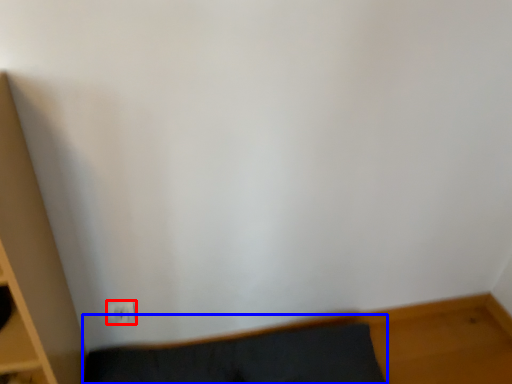
Question: Which object appears closest to the camera in this image, electric outlet (highlighted by a red box) or furniture (highlighted by a blue box)?

Choices:
 (A) electric outlet
 (B) furniture

Answer: (B)